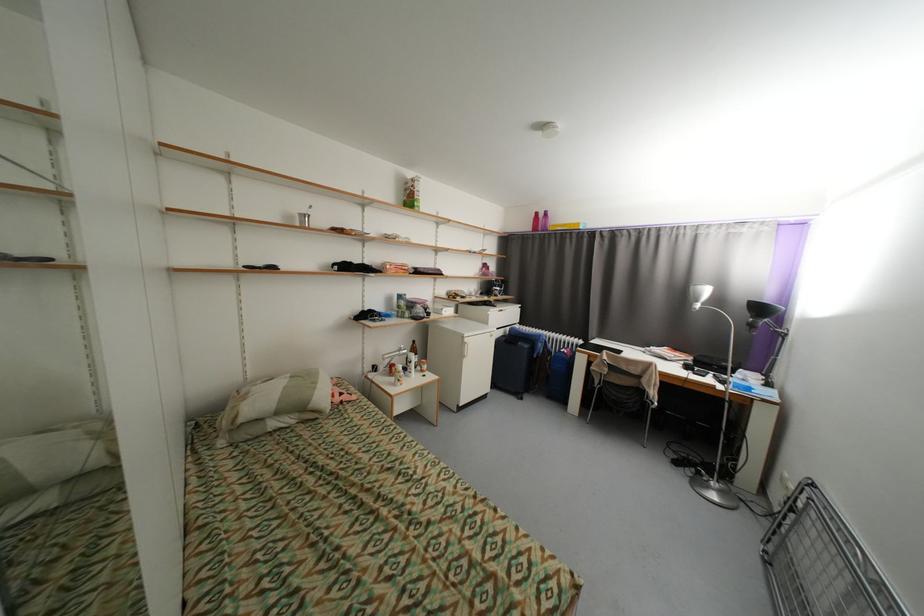
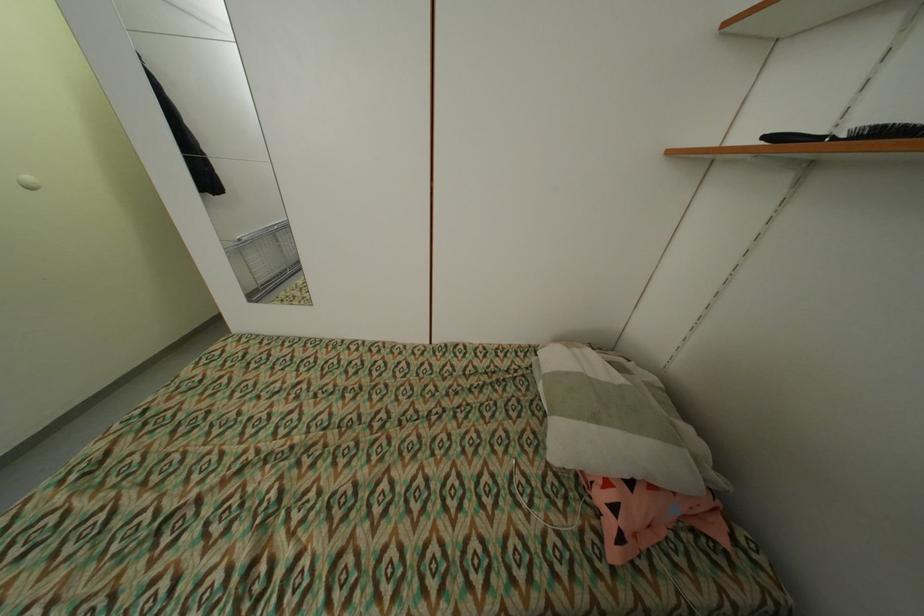
In the second image, find the point that corresponds to point (344, 400) in the first image.

(606, 498)